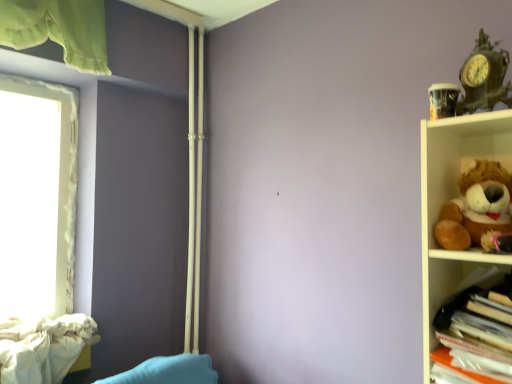
What do you see at coordinates (484, 77) in the screenshot?
I see `antique bronze clock at upper right, the first toy from the top` at bounding box center [484, 77].

This screenshot has width=512, height=384. What do you see at coordinates (475, 326) in the screenshot?
I see `translucent plastic folders at right` at bounding box center [475, 326].

This screenshot has height=384, width=512. Find the location of `brown plush toy at right, the 1th toy in the bottom-to-top sequence`. brown plush toy at right, the 1th toy in the bottom-to-top sequence is located at coordinates (477, 208).

Between antique bronze clock at upper right, the first toy from the top, and white textured curtain at left, which one has smaller size?

With smaller size is antique bronze clock at upper right, the first toy from the top.

Which is in front, antique bronze clock at upper right, the first toy from the top, or white textured curtain at left?

antique bronze clock at upper right, the first toy from the top, is in front.

Does antique bronze clock at upper right, the first toy from the top, touch white textured curtain at left?

antique bronze clock at upper right, the first toy from the top, is not next to white textured curtain at left, and they're not touching.

The width and height of the screenshot is (512, 384). Identify the location of window on the left of the antique bronze clock at upper right, the 2th toy ordered from the bottom. (60, 170).

Is point (480, 37) positioned behind point (502, 203)?

That is True.

Which object is positioned more to the right, antique bronze clock at upper right, the first toy from the top, or brown plush toy at right, the second toy when ordered from top to bottom?

Positioned to the right is brown plush toy at right, the second toy when ordered from top to bottom.

Can you confirm if antique bronze clock at upper right, the first toy from the top, is bigger than brown plush toy at right, the second toy when ordered from top to bottom?

Incorrect, antique bronze clock at upper right, the first toy from the top, is not larger than brown plush toy at right, the second toy when ordered from top to bottom.

From their relative heights in the image, would you say white textured curtain at left is taller or shorter than translucent plastic folders at right?

In the image, white textured curtain at left appears to be taller than translucent plastic folders at right.

Is white textured curtain at left next to translucent plastic folders at right and touching it?

No, white textured curtain at left is not beside translucent plastic folders at right.

From the picture: Between white textured curtain at left and translucent plastic folders at right, which one has smaller width?

white textured curtain at left.

Image resolution: width=512 pixels, height=384 pixels. I want to click on shelf that appears below the white textured curtain at left (from a real-world perspective), so click(x=475, y=326).

Starting from the translucent plastic folders at right, which toy is the 1st one to the right? Please provide its 2D coordinates.

[(484, 77)]

Is antique bronze clock at upper right, the 2th toy ordered from the bottom, in front of or behind translucent plastic folders at right in the image?

Visually, antique bronze clock at upper right, the 2th toy ordered from the bottom, is located behind translucent plastic folders at right.

Which point is more forward, (x=482, y=79) or (x=457, y=367)?

The point (x=457, y=367) is closer to the camera.

Is antique bronze clock at upper right, the first toy from the top, taller or shorter than translucent plastic folders at right?

Clearly, antique bronze clock at upper right, the first toy from the top, is shorter compared to translucent plastic folders at right.

From their relative heights in the image, would you say brown plush toy at right, the 1th toy in the bottom-to-top sequence, is taller or shorter than translucent plastic folders at right?

brown plush toy at right, the 1th toy in the bottom-to-top sequence, is taller than translucent plastic folders at right.

Is point (466, 244) less distant than point (499, 280)?

Yes, point (466, 244) is in front of point (499, 280).

Can you confirm if brown plush toy at right, the second toy when ordered from top to bottom, is positioned to the left of translucent plastic folders at right?

Incorrect, brown plush toy at right, the second toy when ordered from top to bottom, is not on the left side of translucent plastic folders at right.

Is brown plush toy at right, the 1th toy in the bottom-to-top sequence, oriented towards translucent plastic folders at right?

No.

Is translucent plastic folders at right situated inside antique bronze clock at upper right, the first toy from the top, or outside?

translucent plastic folders at right is not enclosed by antique bronze clock at upper right, the first toy from the top.

Considering the positions of point (456, 337) and point (460, 77), is point (456, 337) closer or farther from the camera than point (460, 77)?

Clearly, point (456, 337) is closer to the camera than point (460, 77).

Consider the image. Measure the distance between translucent plastic folders at right and antique bronze clock at upper right, the 2th toy ordered from the bottom.

translucent plastic folders at right is 20.72 inches from antique bronze clock at upper right, the 2th toy ordered from the bottom.

Is antique bronze clock at upper right, the first toy from the top, at the back of translucent plastic folders at right?

No, antique bronze clock at upper right, the first toy from the top, is not at the back of translucent plastic folders at right.

Between brown plush toy at right, the 1th toy in the bottom-to-top sequence, and antique bronze clock at upper right, the 2th toy ordered from the bottom, which one has more height?

Standing taller between the two is brown plush toy at right, the 1th toy in the bottom-to-top sequence.

Based on the photo, is antique bronze clock at upper right, the first toy from the top, a part of brown plush toy at right, the 1th toy in the bottom-to-top sequence?

No, antique bronze clock at upper right, the first toy from the top, is located outside of brown plush toy at right, the 1th toy in the bottom-to-top sequence.

Is brown plush toy at right, the 1th toy in the bottom-to-top sequence, wider or thinner than antique bronze clock at upper right, the first toy from the top?

Clearly, brown plush toy at right, the 1th toy in the bottom-to-top sequence, has more width compared to antique bronze clock at upper right, the first toy from the top.

Is brown plush toy at right, the second toy when ordered from top to bottom, turned away from antique bronze clock at upper right, the first toy from the top?

brown plush toy at right, the second toy when ordered from top to bottom, is not turned away from antique bronze clock at upper right, the first toy from the top.

Find the location of `window that appears behind the antique bronze clock at upper right, the 2th toy ordered from the bottom`. window that appears behind the antique bronze clock at upper right, the 2th toy ordered from the bottom is located at coordinates (60, 170).

Find the location of a particular element. The image size is (512, 384). toy in front of the antique bronze clock at upper right, the first toy from the top is located at coordinates (477, 208).

When comparing their distances from white textured curtain at left, does brown plush toy at right, the second toy when ordered from top to bottom, or translucent plastic folders at right seem closer?

The object closer to white textured curtain at left is translucent plastic folders at right.

From the image, which object appears to be farther from white textured curtain at left, translucent plastic folders at right or brown plush toy at right, the 1th toy in the bottom-to-top sequence?

brown plush toy at right, the 1th toy in the bottom-to-top sequence, lies further to white textured curtain at left than the other object.

From the image, which object appears to be farther from translucent plastic folders at right, brown plush toy at right, the second toy when ordered from top to bottom, or white textured curtain at left?

Among the two, white textured curtain at left is located further to translucent plastic folders at right.

Considering their positions, is white textured curtain at left positioned further to antique bronze clock at upper right, the first toy from the top, than brown plush toy at right, the second toy when ordered from top to bottom?

white textured curtain at left is further to antique bronze clock at upper right, the first toy from the top.

Looking at this image, based on their spatial positions, is brown plush toy at right, the second toy when ordered from top to bottom, or antique bronze clock at upper right, the 2th toy ordered from the bottom, closer to white textured curtain at left?

brown plush toy at right, the second toy when ordered from top to bottom.

When comparing their distances from translucent plastic folders at right, does brown plush toy at right, the 1th toy in the bottom-to-top sequence, or antique bronze clock at upper right, the first toy from the top, seem further?

antique bronze clock at upper right, the first toy from the top, lies further to translucent plastic folders at right than the other object.

From the image, which object appears to be nearer to brown plush toy at right, the second toy when ordered from top to bottom, white textured curtain at left or antique bronze clock at upper right, the 2th toy ordered from the bottom?

antique bronze clock at upper right, the 2th toy ordered from the bottom, lies closer to brown plush toy at right, the second toy when ordered from top to bottom, than the other object.

Based on their spatial positions, is translucent plastic folders at right or antique bronze clock at upper right, the 2th toy ordered from the bottom, closer to white textured curtain at left?

Among the two, translucent plastic folders at right is located nearer to white textured curtain at left.

Identify the location of shelf located between white textured curtain at left and antique bronze clock at upper right, the 2th toy ordered from the bottom, in the left-right direction. (475, 326).

Where is `toy between antique bronze clock at upper right, the 2th toy ordered from the bottom, and translucent plastic folders at right, in the vertical direction`? toy between antique bronze clock at upper right, the 2th toy ordered from the bottom, and translucent plastic folders at right, in the vertical direction is located at coordinates (477, 208).

This screenshot has width=512, height=384. Find the location of `shelf located between white textured curtain at left and brown plush toy at right, the second toy when ordered from top to bottom, in the left-right direction`. shelf located between white textured curtain at left and brown plush toy at right, the second toy when ordered from top to bottom, in the left-right direction is located at coordinates (475, 326).

Where is `toy situated between white textured curtain at left and brown plush toy at right, the second toy when ordered from top to bottom, from left to right`? toy situated between white textured curtain at left and brown plush toy at right, the second toy when ordered from top to bottom, from left to right is located at coordinates (484, 77).